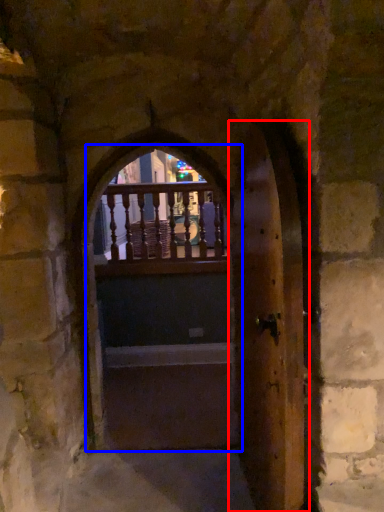
Question: Which of the following is the farthest to the observer, door (highlighted by a red box) or door (highlighted by a blue box)?

Choices:
 (A) door
 (B) door

Answer: (B)